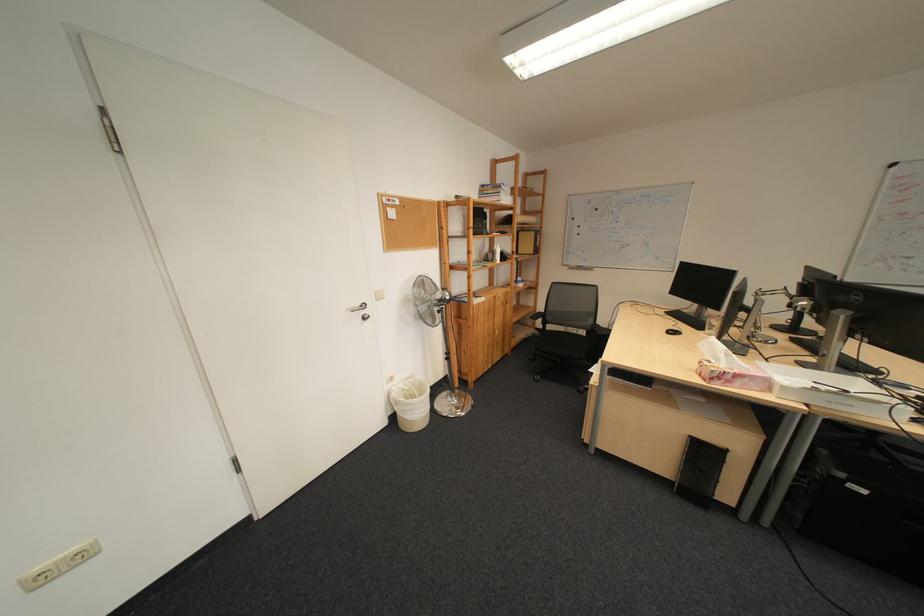
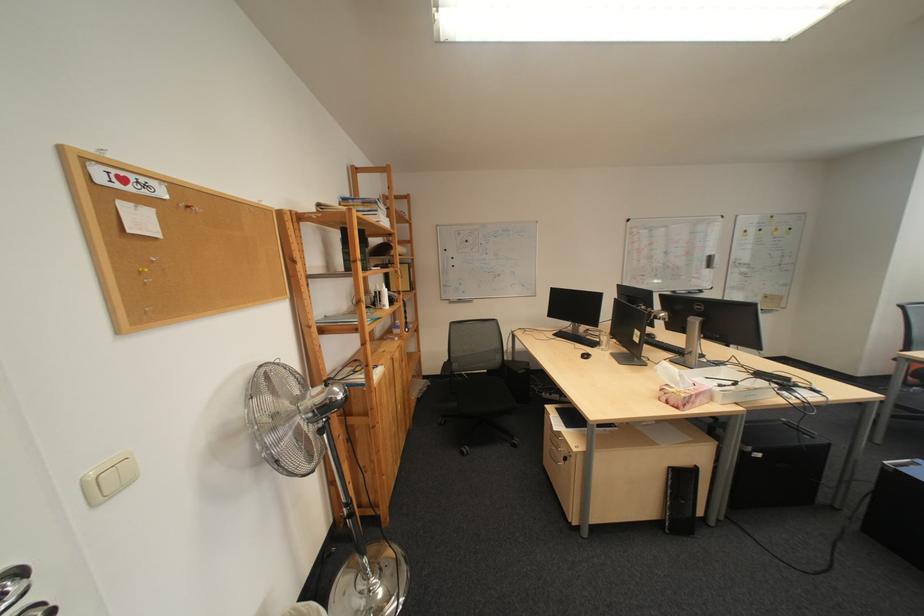
The point at (x=681, y=314) is marked in the first image. Where is the corresponding point in the second image?

(568, 336)